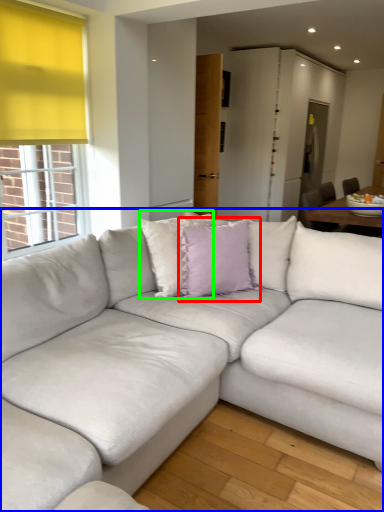
Question: Based on their relative distances, which object is farther from pillow (highlighted by a red box)? Choose from studio couch (highlighted by a blue box) and pillow (highlighted by a green box).

Choices:
 (A) studio couch
 (B) pillow

Answer: (A)